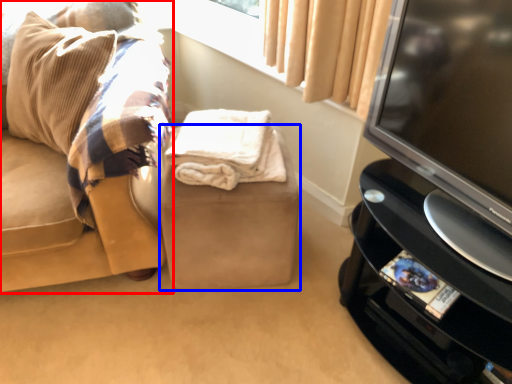
Question: Among these objects, which one is nearest to the camera, studio couch (highlighted by a red box) or stool (highlighted by a blue box)?

Choices:
 (A) studio couch
 (B) stool

Answer: (A)